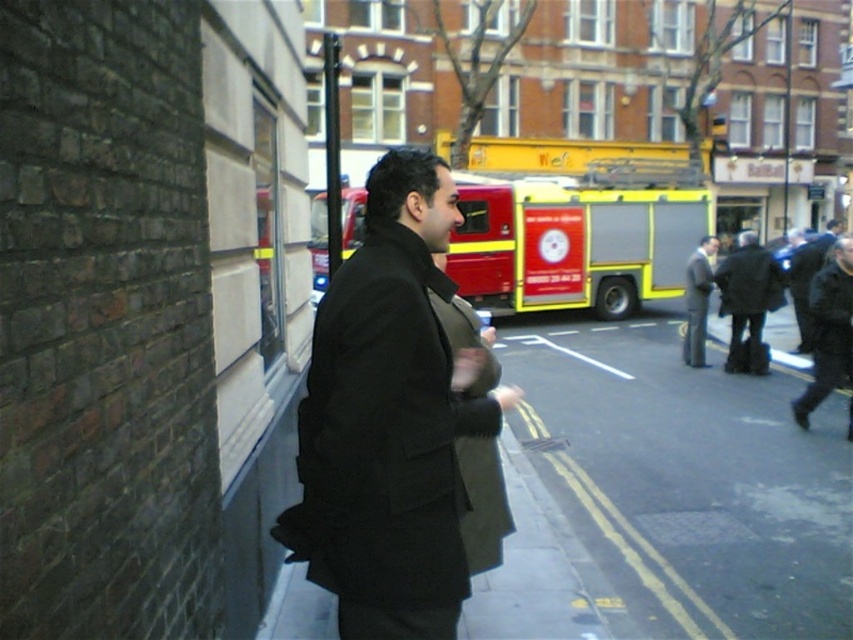
You are standing at the point marked as point (x=747, y=300) in the image. What object is exactly at that location?

The dark wool coat at center is located at point (x=747, y=300).

You are a fashion designer observing two coats in an urban setting. You notice the matte black coat at center and the dark gray jacket at center. Which of these two is more narrow in width?

The matte black coat at center is thinner than the dark gray jacket at center, so the matte black coat at center is more narrow in width.

You are a delivery person needing to place a package between the matte black coat at center and the dark gray jacket at center. Given that the package requires 50 feet of space to safely land, will there be enough space?

The distance between the matte black coat at center and the dark gray jacket at center is 40.69 feet, which is less than the required 50 feet. Therefore, there is not enough space to safely land the package between them.